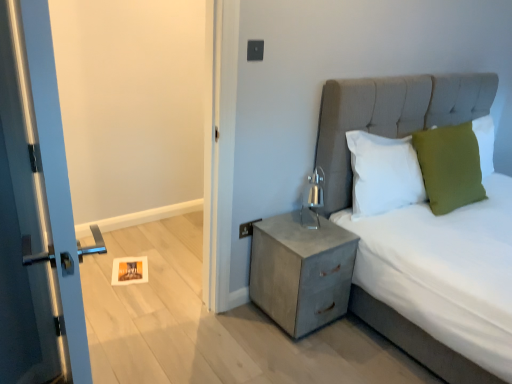
Locate an element on the screen. The image size is (512, 384). unoccupied space behind metallic silver door at left is located at coordinates (158, 361).